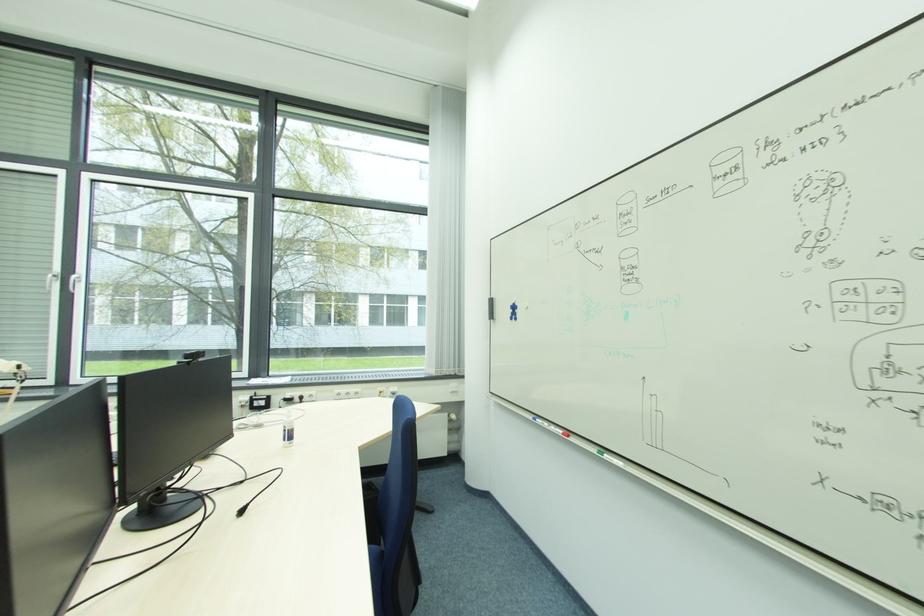
The location [611,458] corresponds to which object?

It refers to a green whiteboard marker.